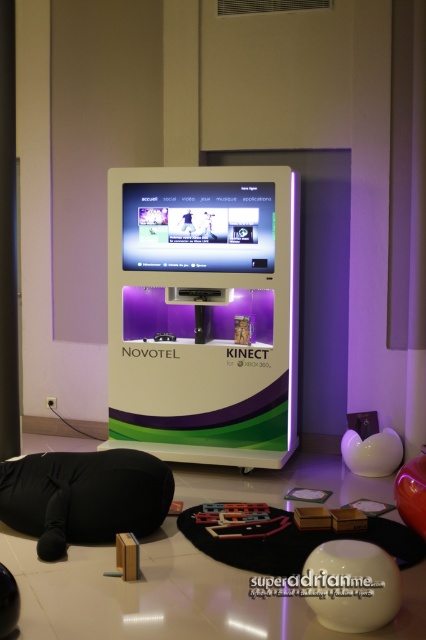
Question: Which point is farther from the camera taking this photo?

Choices:
 (A) (101, 499)
 (B) (181, 460)

Answer: (B)

Question: Can you confirm if matte plastic vending machine at center is smaller than black fabric bean bag at lower left?

Choices:
 (A) yes
 (B) no

Answer: (B)

Question: Can you confirm if matte plastic vending machine at center is positioned below black fabric bean bag at lower left?

Choices:
 (A) yes
 (B) no

Answer: (B)

Question: Which point is closer to the camera?

Choices:
 (A) black fabric bean bag at lower left
 (B) matte plastic vending machine at center

Answer: (A)

Question: Is matte plastic vending machine at center closer to camera compared to black fabric bean bag at lower left?

Choices:
 (A) yes
 (B) no

Answer: (B)

Question: Which object is farther from the camera taking this photo?

Choices:
 (A) matte plastic vending machine at center
 (B) black fabric bean bag at lower left

Answer: (A)